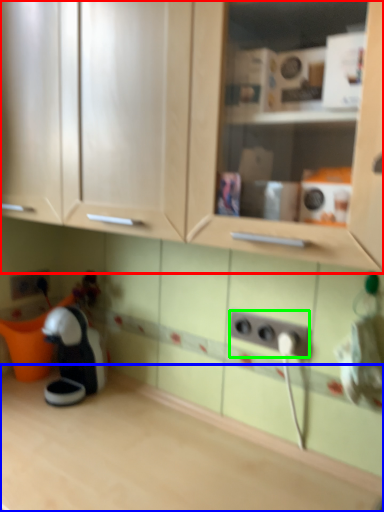
Question: Based on their relative distances, which object is nearer to cabinetry (highlighted by a red box)? Choose from countertop (highlighted by a blue box) and electric outlet (highlighted by a green box).

Choices:
 (A) countertop
 (B) electric outlet

Answer: (B)